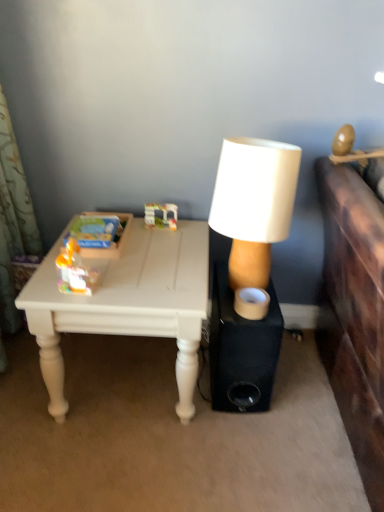
I want to click on vacant point above white matte lamp at center (from a real-world perspective), so click(x=258, y=145).